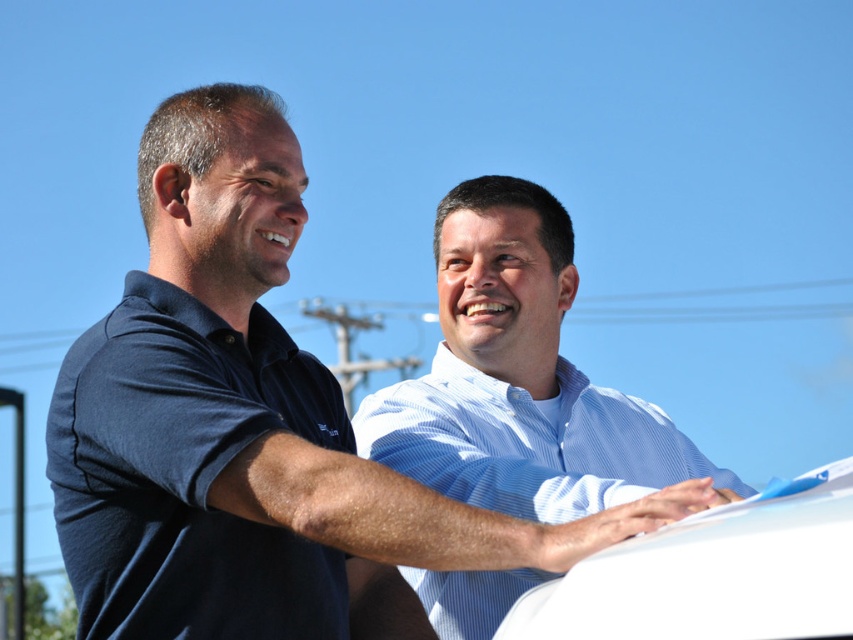
Is blue cotton shirt at upper center below white matte car at center?

No, blue cotton shirt at upper center is not below white matte car at center.

Can you confirm if blue cotton shirt at upper center is shorter than white matte car at center?

In fact, blue cotton shirt at upper center may be taller than white matte car at center.

Is point (297, 529) positioned before point (788, 611)?

That is False.

I want to click on blue cotton shirt at upper center, so click(x=250, y=428).

Can you confirm if blue cotton shirt at upper center is positioned below light blue striped shirt at center?

Yes.

Can you confirm if blue cotton shirt at upper center is smaller than light blue striped shirt at center?

Actually, blue cotton shirt at upper center might be larger than light blue striped shirt at center.

Between point (254, 460) and point (519, 336), which one is positioned behind?

The point (519, 336) is behind.

You are a GUI agent. You are given a task and a screenshot of the screen. Output one action in this format:
    pyautogui.click(x=<x>, y=<y>)
    Task: Click on the blue cotton shirt at upper center
    This screenshot has height=640, width=853.
    Given the screenshot: What is the action you would take?
    pyautogui.click(x=250, y=428)

Locate an element on the screen. The height and width of the screenshot is (640, 853). light blue striped shirt at center is located at coordinates (518, 378).

Is light blue striped shirt at center bigger than white matte car at center?

Indeed, light blue striped shirt at center has a larger size compared to white matte car at center.

Find the location of a particular element. This screenshot has width=853, height=640. light blue striped shirt at center is located at coordinates [x=518, y=378].

Locate an element on the screen. This screenshot has height=640, width=853. light blue striped shirt at center is located at coordinates (518, 378).